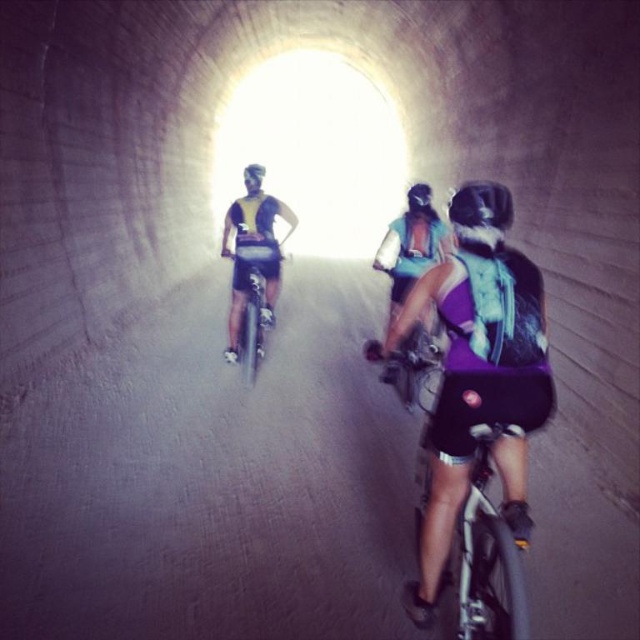
Question: Among these objects, which one is farthest from the camera?

Choices:
 (A) matte black shorts at center
 (B) matte black helmet at center
 (C) purple fabric shorts at center
 (D) purple fabric bag at center

Answer: (A)

Question: Is purple fabric shorts at center to the left of matte white helmet at center from the viewer's perspective?

Choices:
 (A) no
 (B) yes

Answer: (A)

Question: Is purple fabric bag at center positioned before matte black shorts at center?

Choices:
 (A) yes
 (B) no

Answer: (A)

Question: Based on their relative distances, which object is nearer to the matte black helmet at center?

Choices:
 (A) matte white helmet at center
 (B) purple fabric shorts at center
 (C) purple fabric bag at center

Answer: (B)

Question: Which of these objects is positioned farthest from the matte white helmet at center?

Choices:
 (A) purple fabric bag at center
 (B) matte black helmet at center

Answer: (A)

Question: Can you confirm if purple fabric shorts at center is positioned to the right of matte black helmet at center?

Choices:
 (A) yes
 (B) no

Answer: (B)